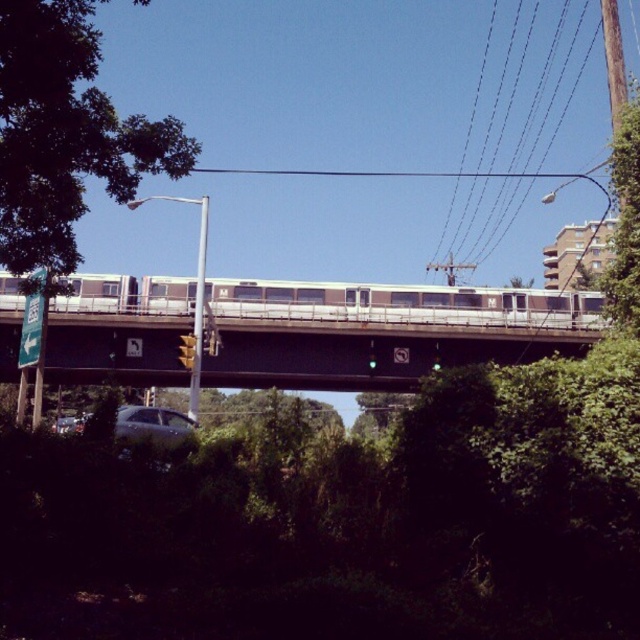
Does silver metallic train at center have a smaller size compared to satin silver sedan at lower left?

No, silver metallic train at center is not smaller than satin silver sedan at lower left.

Does silver metallic train at center have a greater height compared to satin silver sedan at lower left?

In fact, silver metallic train at center may be shorter than satin silver sedan at lower left.

Does point (378, 310) lie behind point (157, 413)?

Yes.

The width and height of the screenshot is (640, 640). I want to click on silver metallic train at center, so click(404, 304).

Does green leafy tree at upper left have a greater height compared to satin silver sedan at lower left?

Yes.

Which is more to the left, green leafy tree at upper left or satin silver sedan at lower left?

green leafy tree at upper left is more to the left.

Locate an element on the screen. The height and width of the screenshot is (640, 640). green leafy tree at upper left is located at coordinates (65, 132).

Can you confirm if green leafy tree at upper left is wider than metallic gray bridge at center?

Yes, green leafy tree at upper left is wider than metallic gray bridge at center.

Who is taller, green leafy tree at upper left or metallic gray bridge at center?

With more height is green leafy tree at upper left.

Is point (81, 112) more distant than point (369, 339)?

No, (81, 112) is closer to viewer.

The image size is (640, 640). Identify the location of green leafy tree at upper left. (x=65, y=132).